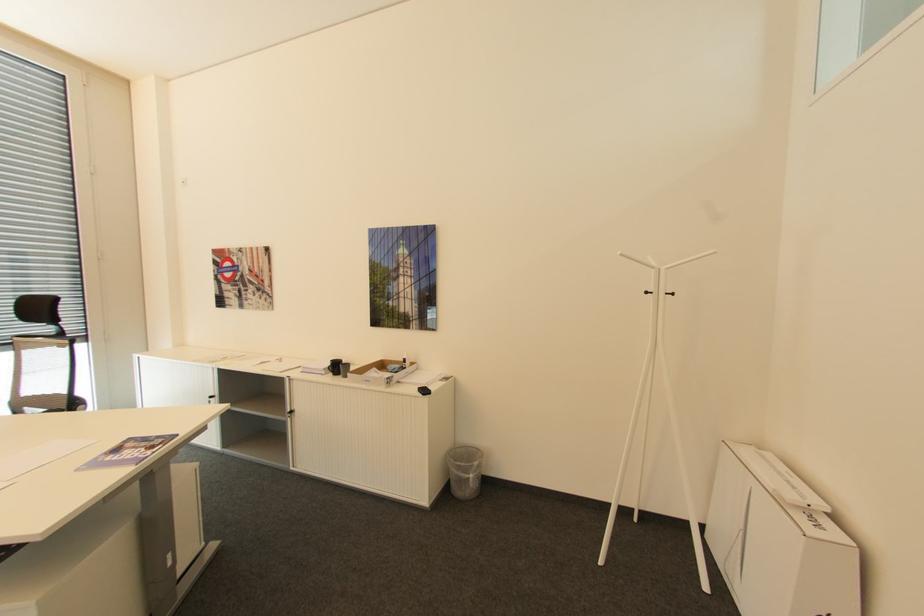
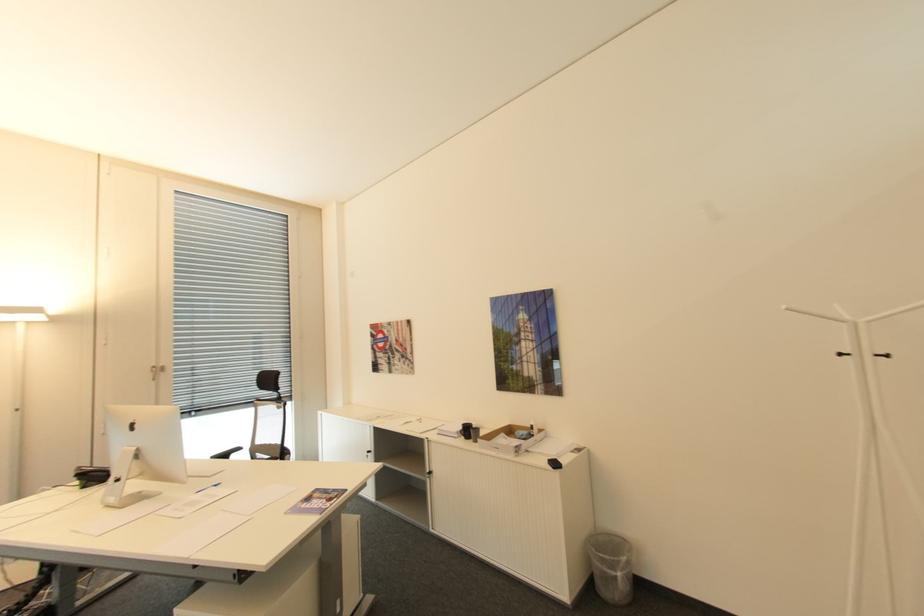
The point at [676,293] is marked in the first image. Where is the corresponding point in the second image?

(894, 355)